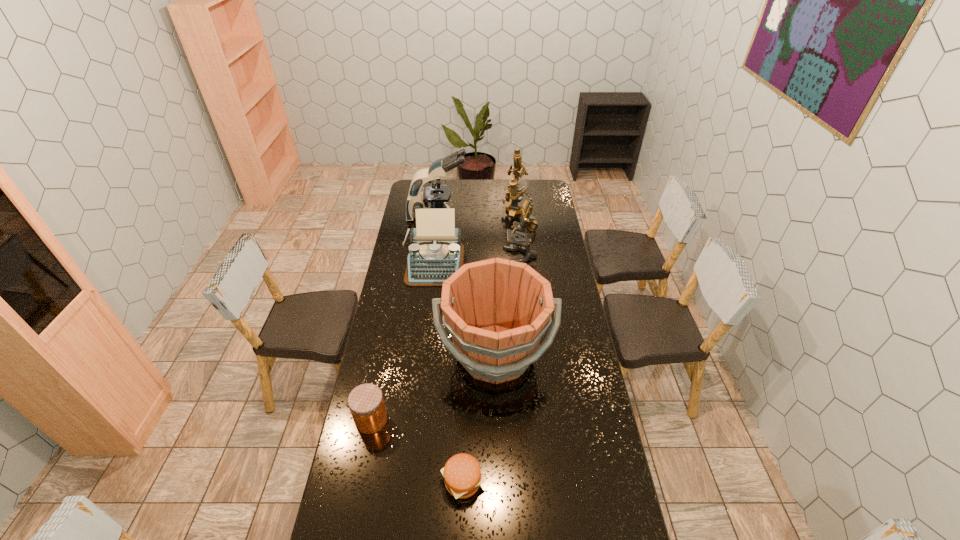
I want to click on free space at the far edge of the desktop, so click(x=469, y=181).

Locate an element on the screen. The height and width of the screenshot is (540, 960). vacant space at the left edge is located at coordinates (403, 320).

This screenshot has height=540, width=960. In the image, there is a desktop. Find the location of `free space at the right edge`. free space at the right edge is located at coordinates (554, 210).

Identify the location of free space at the far right corner. (540, 197).

This screenshot has width=960, height=540. I want to click on vacant area that lies between the nearest microscope and the leftmost microscope, so click(x=479, y=235).

At what (x,y) coordinates should I click in order to perform the action: click on free spot between the third shortest object and the nearest microscope. Please return your answer as a coordinate pair (x, y). Image resolution: width=960 pixels, height=540 pixels. Looking at the image, I should click on (477, 260).

Identify which object is the second nearest to the second nearest object. Please provide its 2D coordinates. Your answer should be formatted as a tuple, i.e. [(x, y)], where the tuple contains the x and y coordinates of a point satisfying the conditions above.

[(462, 474)]

I want to click on the second closest object relative to the hamburger, so click(496, 310).

Identify which microscope is located as the nearest to the leftmost microscope. Please provide its 2D coordinates. Your answer should be formatted as a tuple, i.e. [(x, y)], where the tuple contains the x and y coordinates of a point satisfying the conditions above.

[(513, 195)]

Locate an element on the screen. microscope that is the second closest to the leftmost microscope is located at coordinates (528, 222).